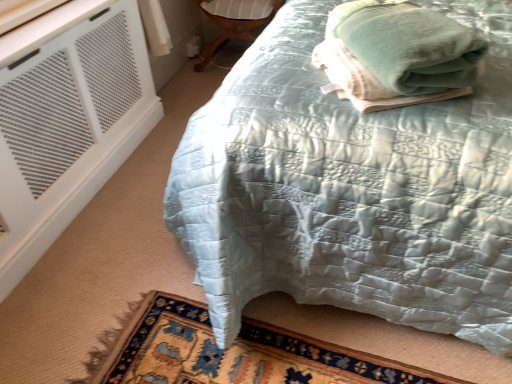
Where is `vacant space that's between silky blue quilt at center and white mesh air conditioning at lower left`? The width and height of the screenshot is (512, 384). vacant space that's between silky blue quilt at center and white mesh air conditioning at lower left is located at coordinates (112, 227).